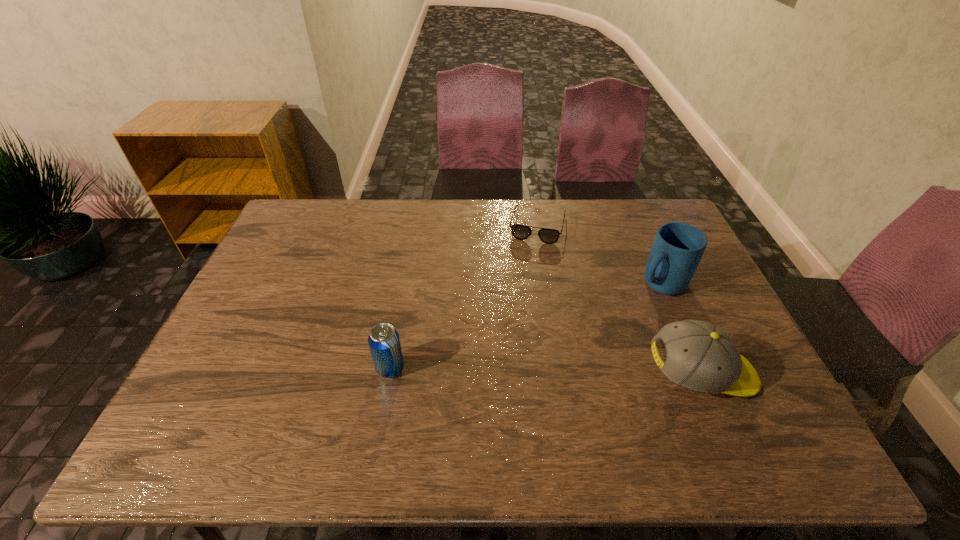
You are a GUI agent. You are given a task and a screenshot of the screen. Output one action in this format:
    pyautogui.click(x=<x>, y=<y>)
    Task: Click on the free spot located on the front-facing side of the second object from left to right
    The image size is (960, 540).
    Given the screenshot: What is the action you would take?
    pyautogui.click(x=522, y=293)

Where is `blank space located 0.300m on the front-facing side of the second object from left to right`? This screenshot has width=960, height=540. blank space located 0.300m on the front-facing side of the second object from left to right is located at coordinates (518, 308).

Find the location of a particular element. This screenshot has height=540, width=960. object that is positioned at the far edge is located at coordinates (521, 232).

You are a GUI agent. You are given a task and a screenshot of the screen. Output one action in this format:
    pyautogui.click(x=<x>, y=<y>)
    Task: Click on the object that is at the near edge
    The image size is (960, 540).
    Given the screenshot: What is the action you would take?
    pyautogui.click(x=701, y=357)

The height and width of the screenshot is (540, 960). I want to click on baseball cap that is at the right edge, so click(x=701, y=357).

Find the location of a particular element. This screenshot has height=540, width=960. mug at the right edge is located at coordinates (678, 247).

This screenshot has width=960, height=540. What are the coordinates of `object located in the near right corner section of the desktop` in the screenshot? It's located at (701, 357).

Where is `vacant space at the far edge of the desktop`? vacant space at the far edge of the desktop is located at coordinates (365, 212).

You are a GUI agent. You are given a task and a screenshot of the screen. Output one action in this format:
    pyautogui.click(x=<x>, y=<y>)
    Task: Click on the free point at the near edge
    Image resolution: width=960 pixels, height=540 pixels.
    Given the screenshot: What is the action you would take?
    pyautogui.click(x=436, y=409)

The height and width of the screenshot is (540, 960). Identify the location of vacant position at the left edge of the desktop. (252, 374).